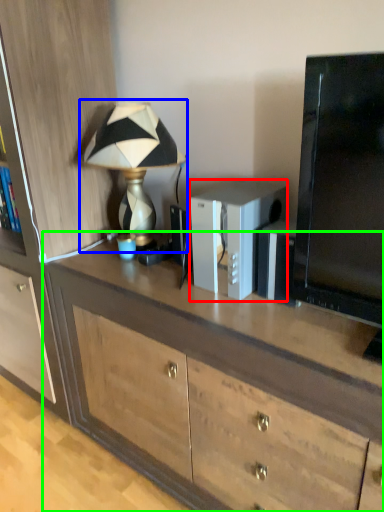
Question: Estimate the real-world distances between objects in this image. Which object is closer to appliance (highlighted by a red box), lamp (highlighted by a blue box) or desk (highlighted by a green box)?

Choices:
 (A) lamp
 (B) desk

Answer: (B)